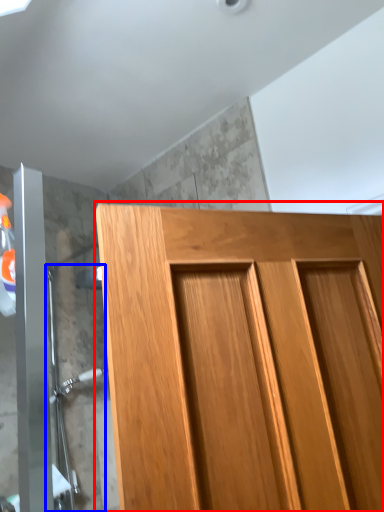
Question: Which point is further to the camera, door (highlighted by a red box) or shower door (highlighted by a blue box)?

Choices:
 (A) door
 (B) shower door

Answer: (B)